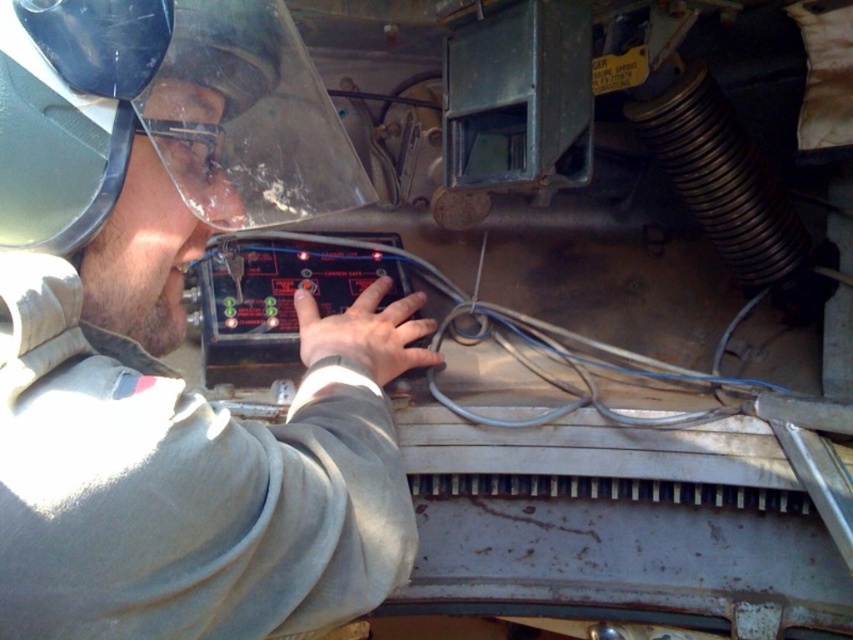
Which of these two, matte black control panel at center or clear plastic helmet at upper left, stands taller?

With more height is matte black control panel at center.

Does matte black control panel at center appear under clear plastic helmet at upper left?

Yes, matte black control panel at center is below clear plastic helmet at upper left.

You are a GUI agent. You are given a task and a screenshot of the screen. Output one action in this format:
    pyautogui.click(x=<x>, y=<y>)
    Task: Click on the matte black control panel at center
    The image size is (853, 640).
    Given the screenshot: What is the action you would take?
    pyautogui.click(x=170, y=349)

Can you confirm if matte black control panel at center is smaller than transparent plastic goggles at upper center?

Actually, matte black control panel at center might be larger than transparent plastic goggles at upper center.

Who is positioned more to the right, matte black control panel at center or transparent plastic goggles at upper center?

From the viewer's perspective, matte black control panel at center appears more on the right side.

Is point (399, 518) less distant than point (187, 122)?

No, (399, 518) is behind (187, 122).

This screenshot has height=640, width=853. Identify the location of matte black control panel at center. (170, 349).

Describe the element at coordinates (119, 108) in the screenshot. I see `clear plastic helmet at upper left` at that location.

Which is behind, point (184, 176) or point (218, 145)?

Point (218, 145)

Identify the location of clear plastic helmet at upper left. (119, 108).